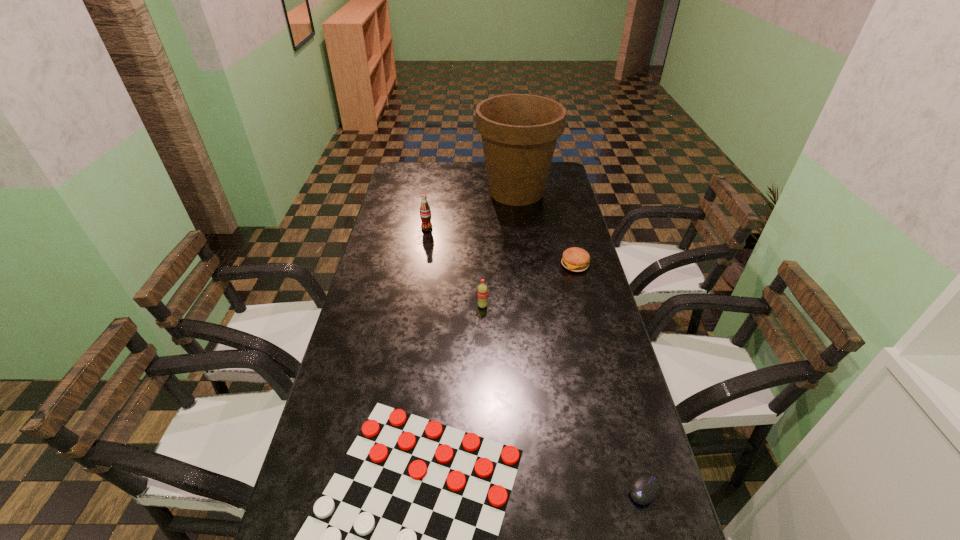
Locate an element on the screen. Image resolution: width=960 pixels, height=540 pixels. vacant space located 0.260m on the back of the farther soda is located at coordinates point(433,191).

You are a GUI agent. You are given a task and a screenshot of the screen. Output one action in this format:
    pyautogui.click(x=<x>, y=<y>)
    Task: Click on the blank area located on the right of the shorter soda
    
    Given the screenshot: What is the action you would take?
    pyautogui.click(x=514, y=306)

Where is `vacant space located on the back of the hamburger`? This screenshot has height=540, width=960. vacant space located on the back of the hamburger is located at coordinates (560, 203).

Where is `vacant space located on the left of the second shortest object`? The height and width of the screenshot is (540, 960). vacant space located on the left of the second shortest object is located at coordinates (470, 490).

What are the coordinates of `object that is at the far edge` in the screenshot? It's located at (519, 132).

Identify the location of flowerpot at the right edge. This screenshot has width=960, height=540. pyautogui.click(x=519, y=132).

I want to click on hamburger present at the right edge, so click(x=575, y=259).

Locate an element on the screen. This screenshot has width=960, height=540. computer mouse present at the right edge is located at coordinates pyautogui.click(x=645, y=487).

Find the location of a particular element. The width and height of the screenshot is (960, 540). object at the far right corner is located at coordinates (519, 132).

In the image, there is a desktop. Where is `vacant space at the far edge`? The height and width of the screenshot is (540, 960). vacant space at the far edge is located at coordinates (450, 183).